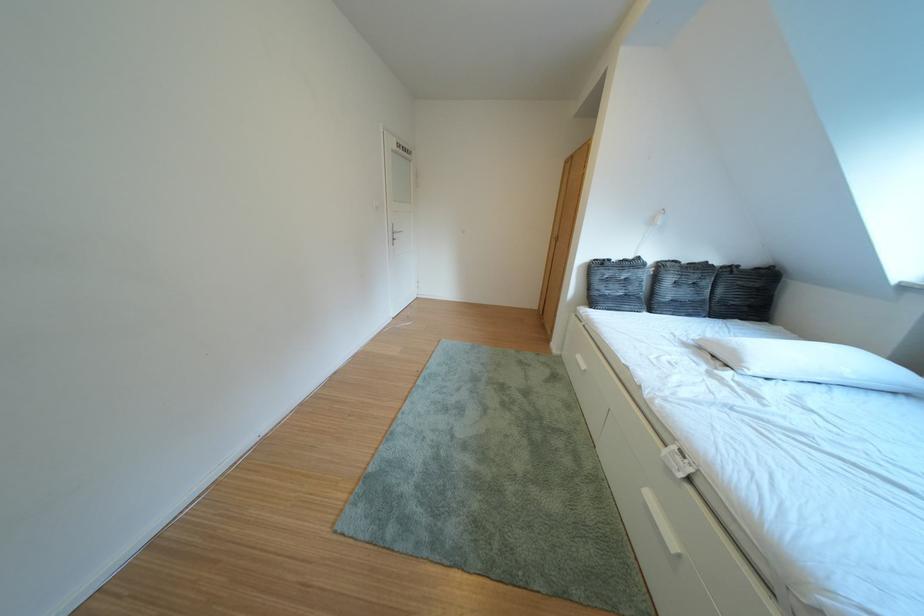
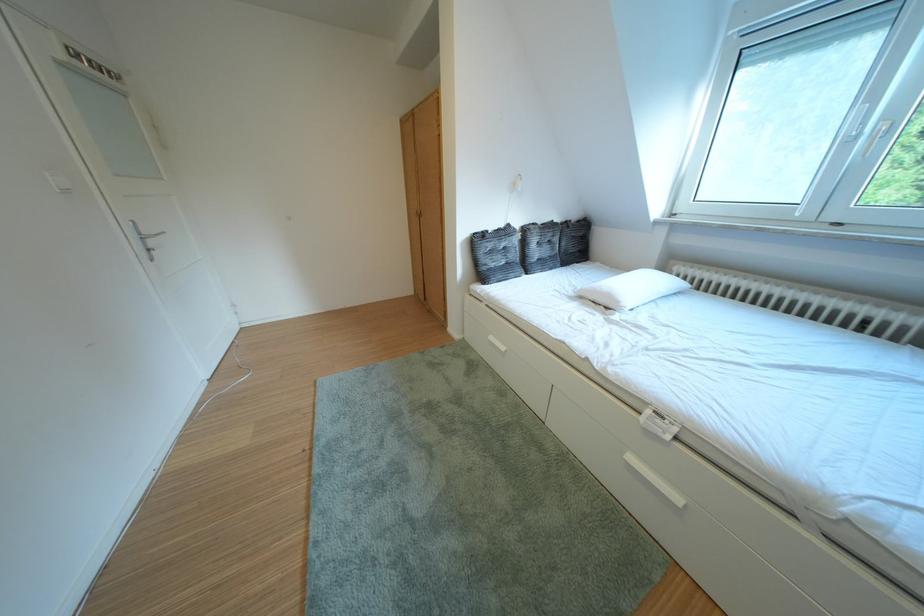
Locate, in the second image, the point that corresponds to (x=652, y=262) in the first image.

(523, 230)